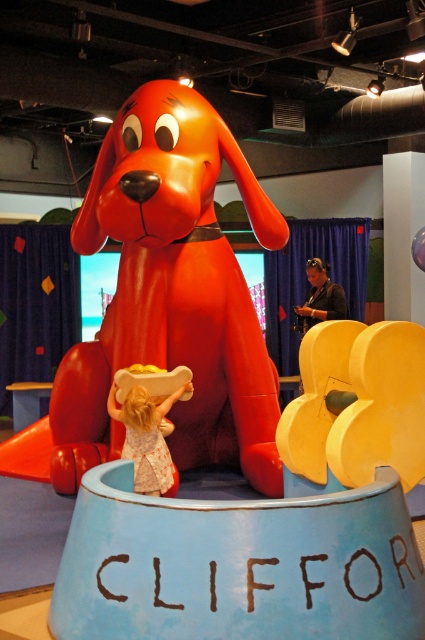
Is glossy plastic dog at center shorter than light pink fabric dress at center?

No.

Where is `glossy plastic dog at center`? This screenshot has width=425, height=640. glossy plastic dog at center is located at coordinates tap(167, 298).

Who is more forward, (197,154) or (122,412)?

Point (122,412) is more forward.

In order to click on glossy plastic dog at center in this screenshot , I will do pyautogui.click(x=167, y=298).